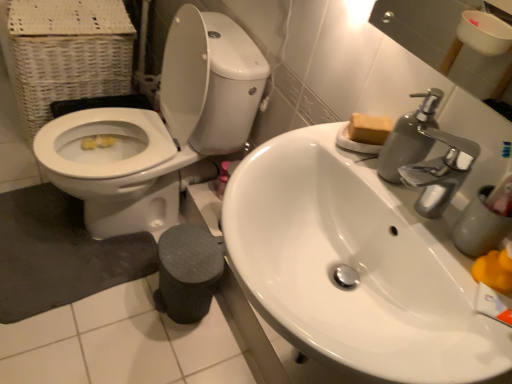
You are a GUI agent. You are given a task and a screenshot of the screen. Output one action in this format:
    pyautogui.click(x=<x>, y=<y>)
    Task: Click on the vacant area that is in front of brown matte soap at upper right
    
    Given the screenshot: What is the action you would take?
    pyautogui.click(x=378, y=176)